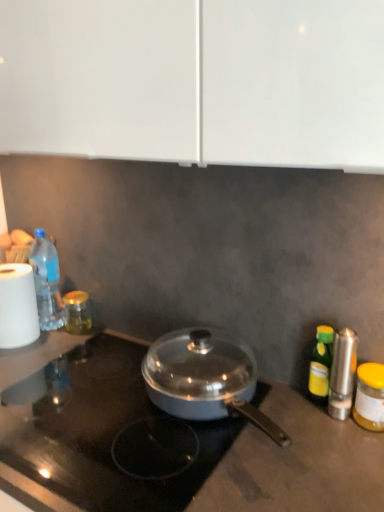
The height and width of the screenshot is (512, 384). I want to click on vacant area to the left of yellow matte jar at right, positioned as the fourth bottle in left-to-right order, so click(294, 425).